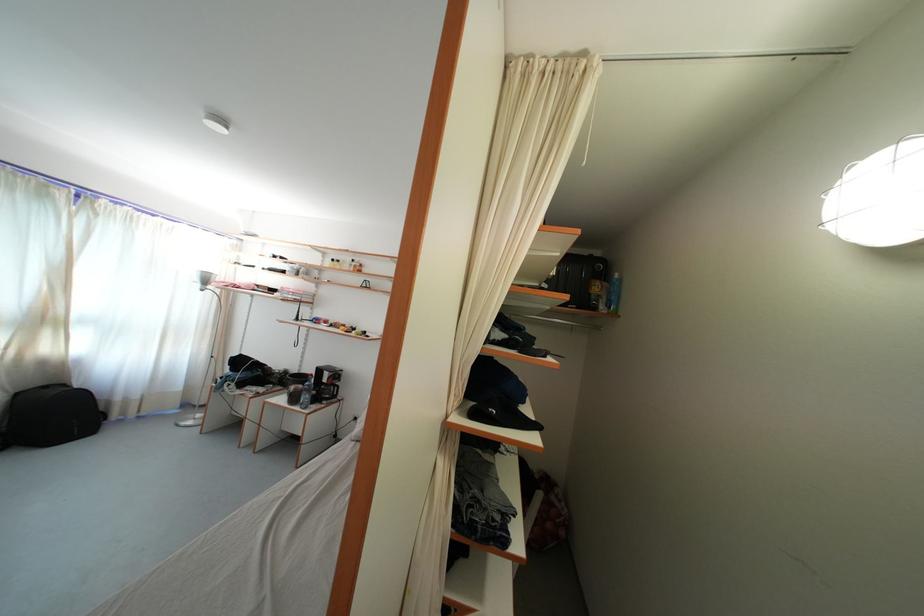
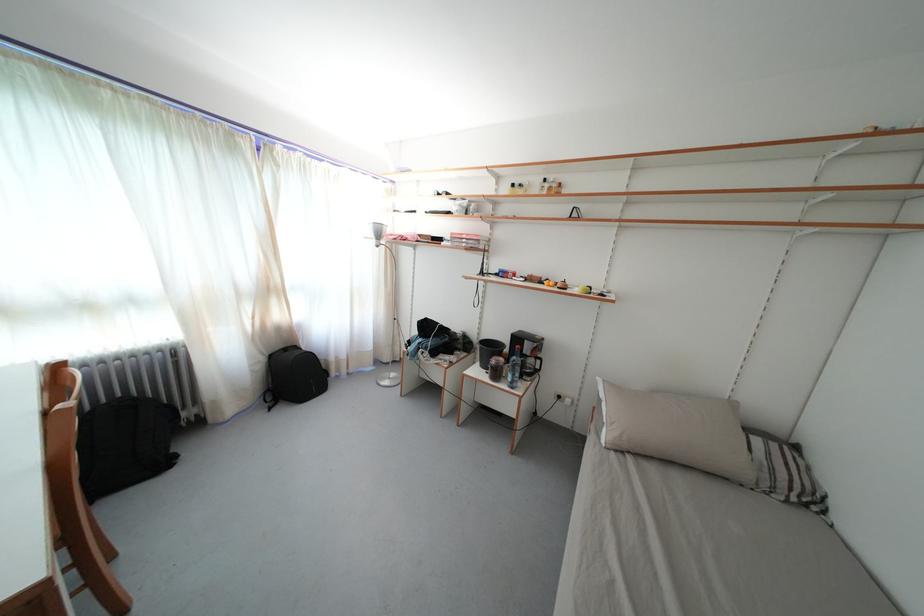
Find the pixel in the second image that matches pixel 310 377 in the first image.

(491, 341)